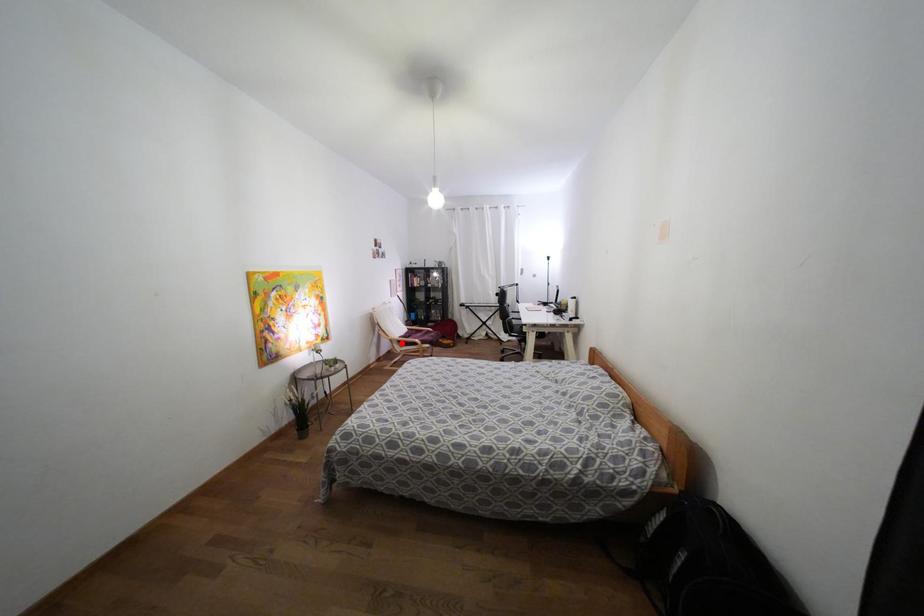
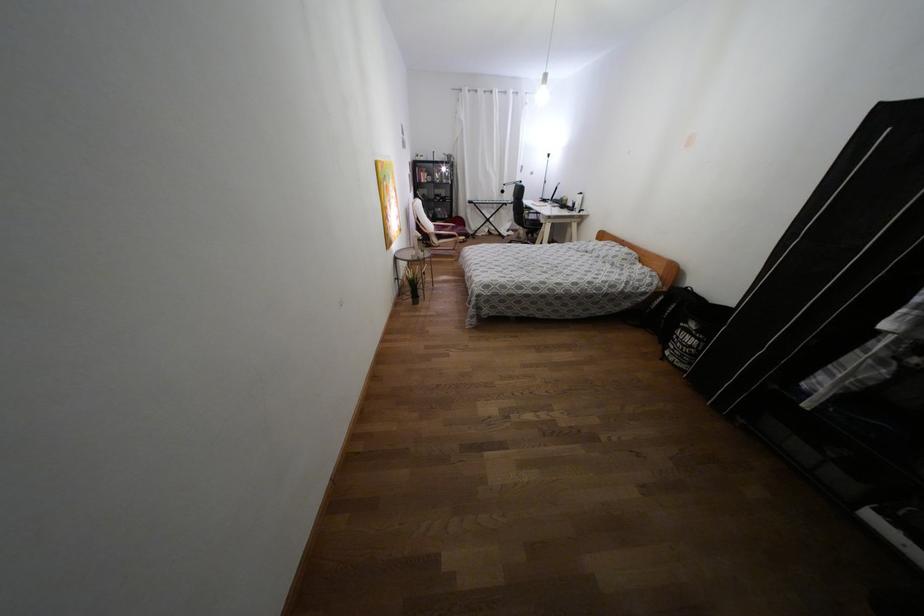
Locate, in the second image, the point that corresponds to the highlighted location in the first image.

(439, 237)